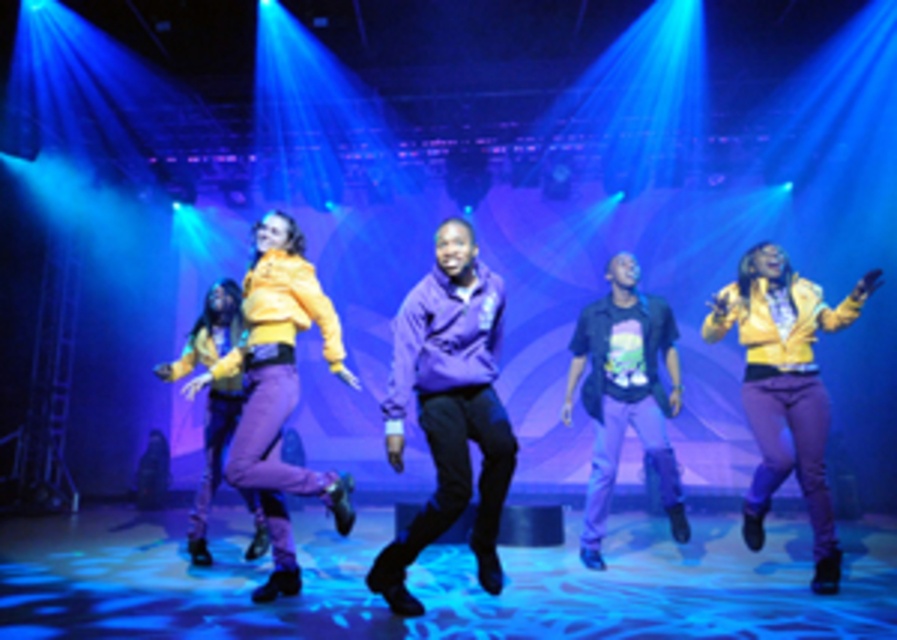
Question: Which point appears farthest from the camera in this image?

Choices:
 (A) (654, 353)
 (B) (303, 301)
 (C) (196, 540)

Answer: (C)

Question: Among these objects, which one is nearest to the camera?

Choices:
 (A) purple matte hoodie at center
 (B) black matte shirt at center

Answer: (A)

Question: Is purple matte hoodie at center above matte yellow jacket at left?

Choices:
 (A) no
 (B) yes

Answer: (A)

Question: Which point appears farthest from the camera in this image?

Choices:
 (A) (651, 326)
 (B) (236, 442)
 (C) (424, 531)
 (D) (768, 305)

Answer: (A)

Question: Considering the relative positions of yellow matte jacket at center and black matte shirt at center in the image provided, where is yellow matte jacket at center located with respect to black matte shirt at center?

Choices:
 (A) below
 (B) above

Answer: (B)

Question: Is purple matte hoodie at center behind black matte shirt at center?

Choices:
 (A) no
 (B) yes

Answer: (A)